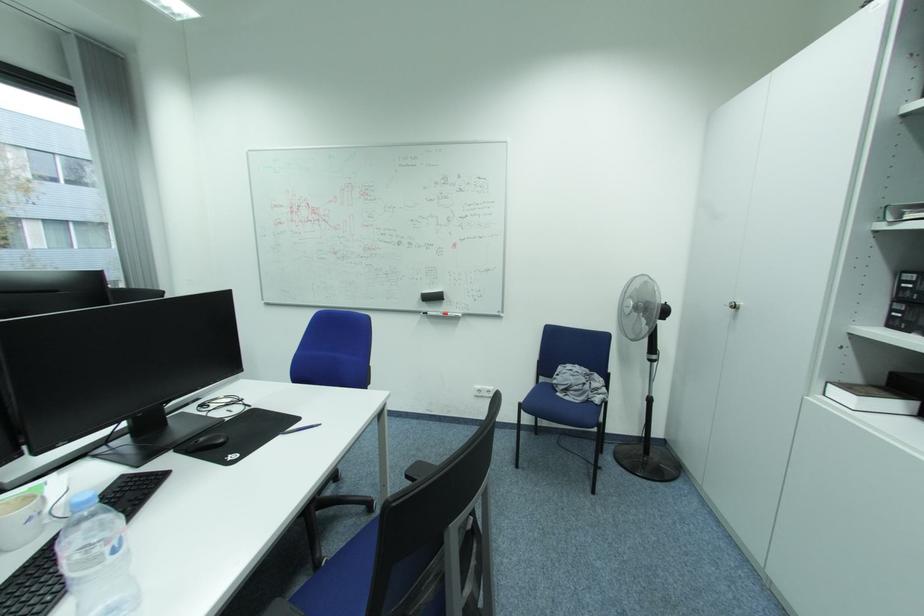
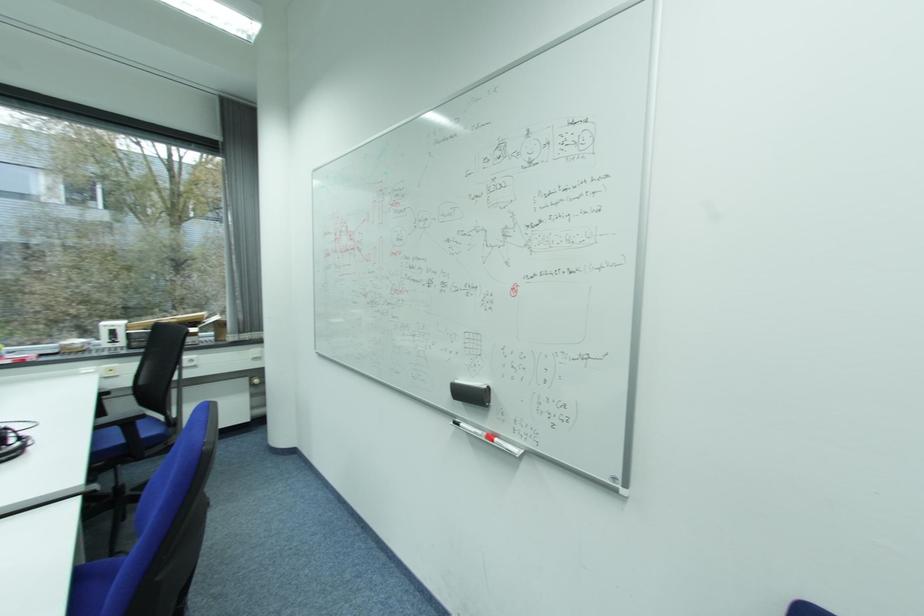
The point at (423,304) is marked in the first image. Where is the corresponding point in the second image?

(453, 398)